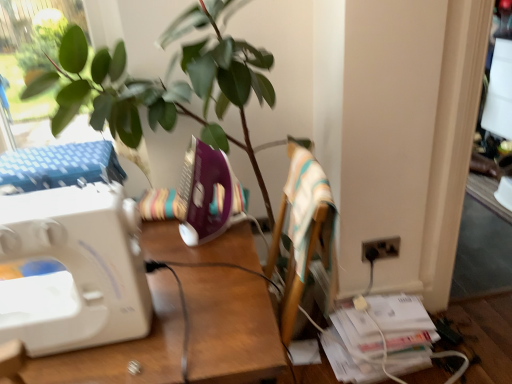
Question: In which direction should I rotate to look at purple plastic sewing machine at center, acting as the 2th sewing machine starting from the front?

Choices:
 (A) right
 (B) left

Answer: (B)

Question: Does white plastic sewing machine at left come behind striped fabric armchair at center?

Choices:
 (A) yes
 (B) no

Answer: (B)

Question: Does white plastic sewing machine at left have a greater width compared to striped fabric armchair at center?

Choices:
 (A) yes
 (B) no

Answer: (A)

Question: Can we say white plastic sewing machine at left lies outside striped fabric armchair at center?

Choices:
 (A) no
 (B) yes

Answer: (B)

Question: Considering the relative sizes of white plastic sewing machine at left and striped fabric armchair at center in the image provided, is white plastic sewing machine at left thinner than striped fabric armchair at center?

Choices:
 (A) yes
 (B) no

Answer: (B)

Question: Considering the relative sizes of white plastic sewing machine at left and striped fabric armchair at center in the image provided, is white plastic sewing machine at left shorter than striped fabric armchair at center?

Choices:
 (A) yes
 (B) no

Answer: (B)

Question: Is white plastic sewing machine at left to the right of striped fabric armchair at center from the viewer's perspective?

Choices:
 (A) yes
 (B) no

Answer: (B)

Question: Is white plastic sewing machine at left bigger than purple plastic sewing machine at center, arranged as the first sewing machine when viewed from the back?

Choices:
 (A) yes
 (B) no

Answer: (A)

Question: Is white plastic sewing machine at left turned away from purple plastic sewing machine at center, the second sewing machine when ordered from left to right?

Choices:
 (A) yes
 (B) no

Answer: (B)

Question: From a real-world perspective, is white plastic sewing machine at left on top of purple plastic sewing machine at center, which is the first sewing machine in right-to-left order?

Choices:
 (A) yes
 (B) no

Answer: (B)

Question: Can you confirm if white plastic sewing machine at left is smaller than purple plastic sewing machine at center, which is the first sewing machine in right-to-left order?

Choices:
 (A) yes
 (B) no

Answer: (B)

Question: Considering the relative sizes of white plastic sewing machine at left and purple plastic sewing machine at center, which is the first sewing machine in right-to-left order, in the image provided, is white plastic sewing machine at left shorter than purple plastic sewing machine at center, which is the first sewing machine in right-to-left order,?

Choices:
 (A) yes
 (B) no

Answer: (B)

Question: Are white plastic sewing machine at left and purple plastic sewing machine at center, which is the first sewing machine in right-to-left order, located far from each other?

Choices:
 (A) no
 (B) yes

Answer: (A)

Question: Considering the relative positions of purple plastic sewing machine at center, acting as the 2th sewing machine starting from the front, and white plastic sewing machine at left, the 2th sewing machine in the back-to-front sequence, in the image provided, is purple plastic sewing machine at center, acting as the 2th sewing machine starting from the front, to the right of white plastic sewing machine at left, the 2th sewing machine in the back-to-front sequence, from the viewer's perspective?

Choices:
 (A) no
 (B) yes

Answer: (B)